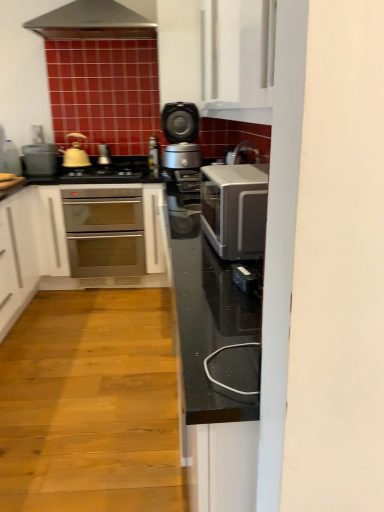
Question: Is matte yellow tea pot at left facing away from stainless steel oven at center?

Choices:
 (A) no
 (B) yes

Answer: (A)

Question: Can you confirm if matte yellow tea pot at left is taller than stainless steel oven at center?

Choices:
 (A) yes
 (B) no

Answer: (B)

Question: From a real-world perspective, is matte yellow tea pot at left physically below stainless steel oven at center?

Choices:
 (A) no
 (B) yes

Answer: (A)

Question: Can you confirm if matte yellow tea pot at left is bigger than stainless steel oven at center?

Choices:
 (A) yes
 (B) no

Answer: (B)

Question: From a real-world perspective, is matte yellow tea pot at left positioned over stainless steel oven at center based on gravity?

Choices:
 (A) no
 (B) yes

Answer: (B)

Question: Considering the relative sizes of matte yellow tea pot at left and stainless steel oven at center in the image provided, is matte yellow tea pot at left smaller than stainless steel oven at center?

Choices:
 (A) no
 (B) yes

Answer: (B)

Question: From a real-world perspective, is satin silver cooker at center physically below satin silver kettle at center, acting as the second appliance starting from the left?

Choices:
 (A) yes
 (B) no

Answer: (B)

Question: Can you confirm if satin silver cooker at center is positioned to the left of satin silver kettle at center, the 1th appliance positioned from the right?

Choices:
 (A) yes
 (B) no

Answer: (B)

Question: Is satin silver cooker at center at the right side of satin silver kettle at center, the 1th appliance positioned from the right?

Choices:
 (A) no
 (B) yes

Answer: (B)

Question: Is satin silver cooker at center shorter than satin silver kettle at center, acting as the second appliance starting from the left?

Choices:
 (A) no
 (B) yes

Answer: (A)

Question: From the image's perspective, is satin silver cooker at center below satin silver kettle at center, acting as the second appliance starting from the left?

Choices:
 (A) yes
 (B) no

Answer: (A)

Question: From the image's perspective, is satin silver cooker at center above satin silver kettle at center, acting as the second appliance starting from the left?

Choices:
 (A) yes
 (B) no

Answer: (B)

Question: Is satin silver cooker at center to the right of matte yellow tea pot at left from the viewer's perspective?

Choices:
 (A) no
 (B) yes

Answer: (B)